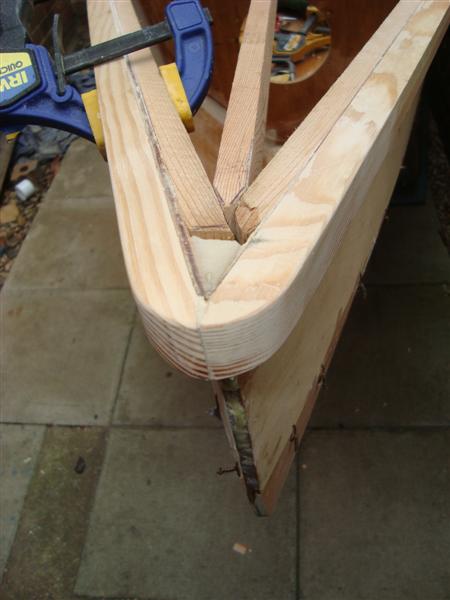
You are a GUI agent. You are given a task and a screenshot of the screen. Output one action in this format:
    pyautogui.click(x=<x>, y=<y>)
    Task: Click on the wall
    
    Given the screenshot: What is the action you would take?
    pyautogui.click(x=224, y=32)